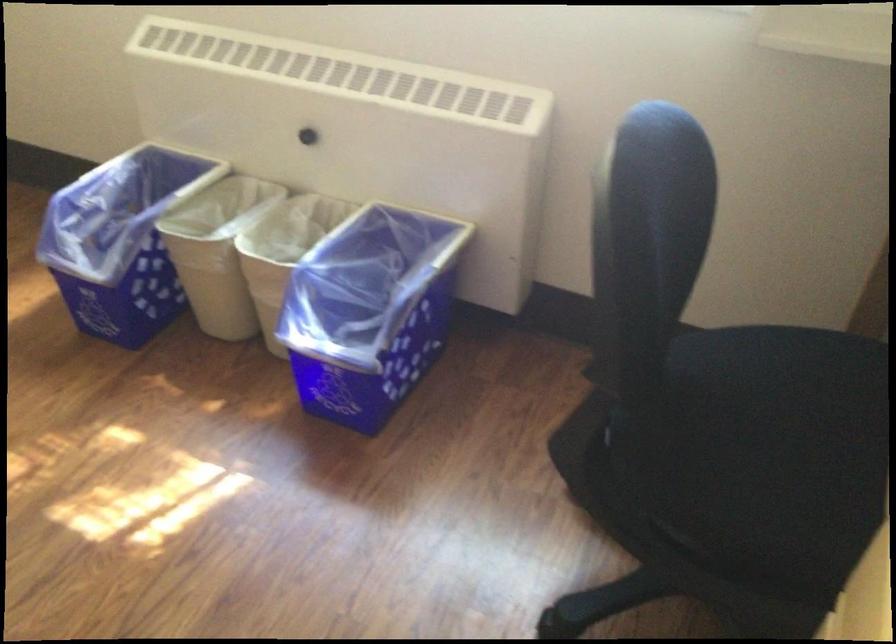
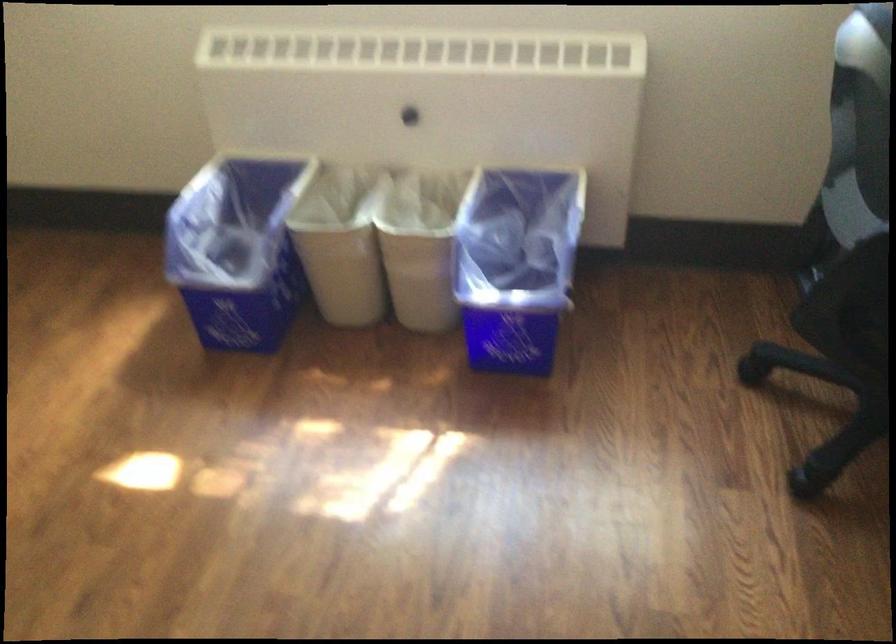
The point at (126, 240) is marked in the first image. Where is the corresponding point in the second image?

(237, 249)